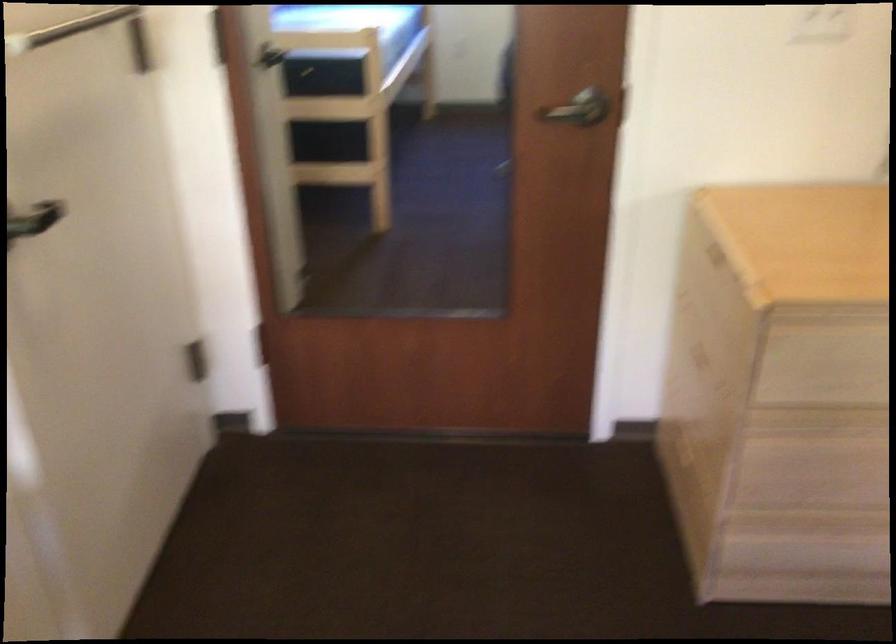
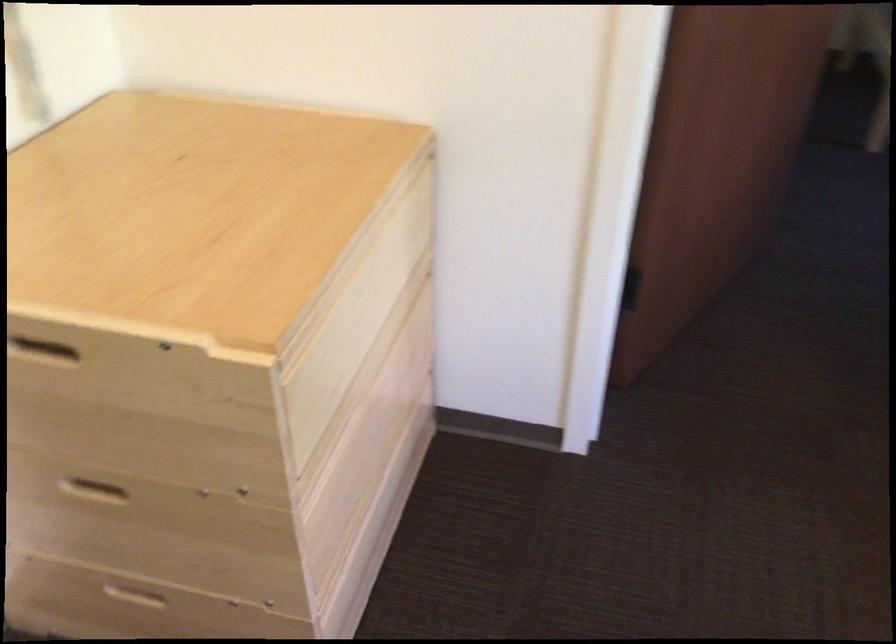
Find the pixel in the second image that matches (695,355) in the first image.

(90, 488)